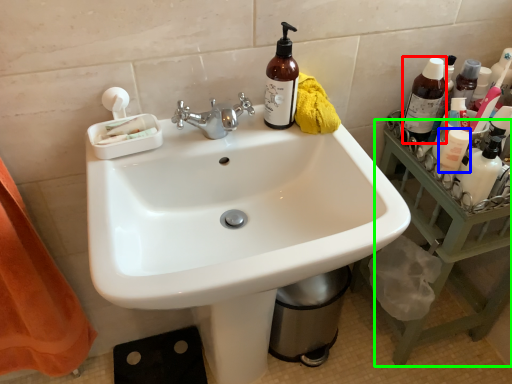
Question: Which object is the closest to the bottle (highlighted by a red box)? Choose among these: mouthwash (highlighted by a blue box) or counter top (highlighted by a green box).

Choices:
 (A) mouthwash
 (B) counter top

Answer: (A)